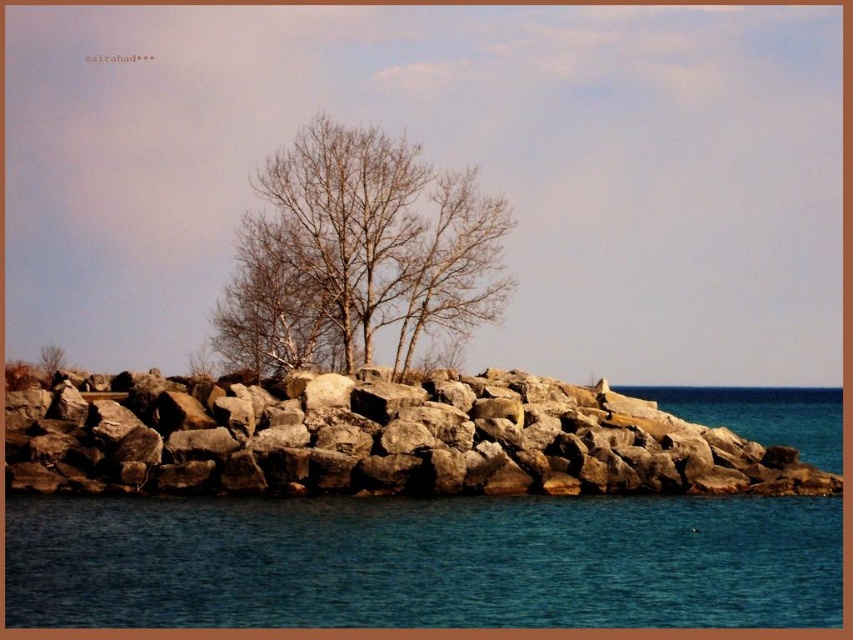
Looking at this image, you are standing on the rocky jetty and looking towards the blue water at lower center and the bare branches at center. Which one appears taller from your viewpoint?

The bare branches at center appear taller than the blue water at lower center because the blue water at lower center is not as tall as the bare branches at center.

You are standing at the rocky jetty and want to reach the two points marked in the image. Which point, point (695,616) or point (413,461), is closer to you?

Point (695,616) is closer to the viewer than point (413,461).